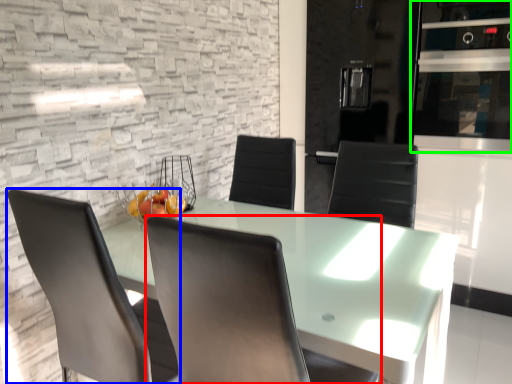
Question: Considering the real-world distances, which object is farthest from chair (highlighted by a red box)? chair (highlighted by a blue box) or appliance (highlighted by a green box)?

Choices:
 (A) chair
 (B) appliance

Answer: (B)